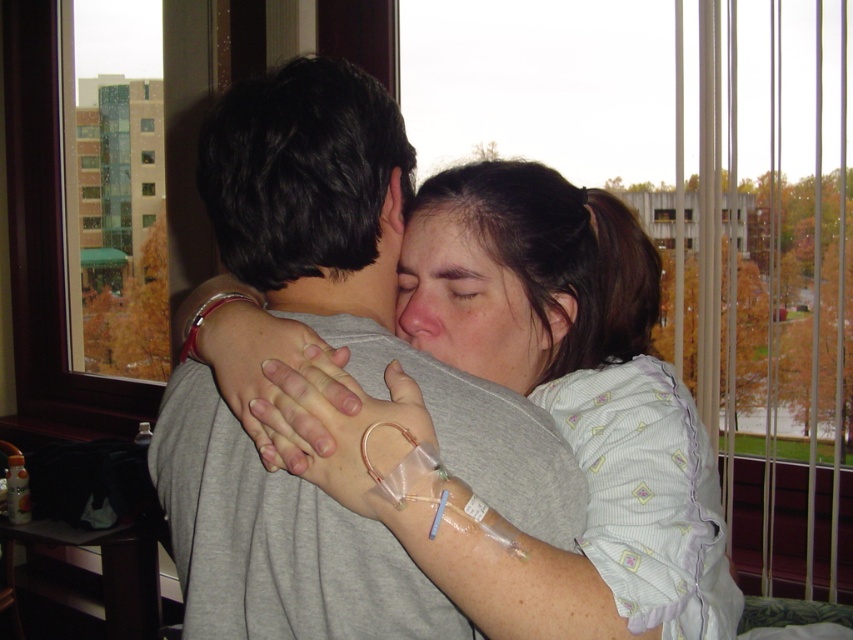
Based on the photo, you are a healthcare professional checking the vital signs of the person at point [471,304]. Can you confirm if the face at that point belongs to the person in the gray T shirt or the one in light colored pajamas?

The smooth skin face at center is located at point [471,304], so the face belongs to the person in the gray T shirt since they are facing away from the camera and their back is turned, while the other person is embracing them from behind.

You are a medical professional assessing the patients in the hospital room. You need to determine which part of the face is wider between the smooth skin face at center and the matte skin forehead at center. Based on the description, which one is wider?

The smooth skin face at center is wider than the matte skin forehead at center according to the description.